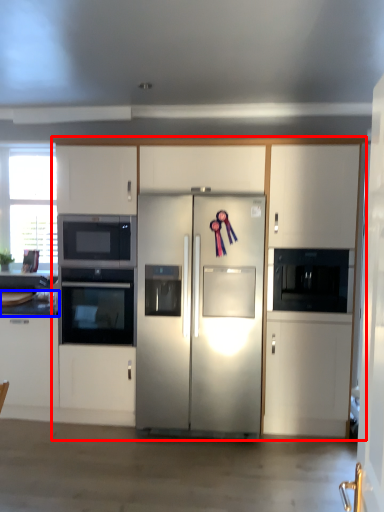
Question: Which object appears farthest to the camera in this image, cabinetry (highlighted by a red box) or countertop (highlighted by a blue box)?

Choices:
 (A) cabinetry
 (B) countertop

Answer: (B)